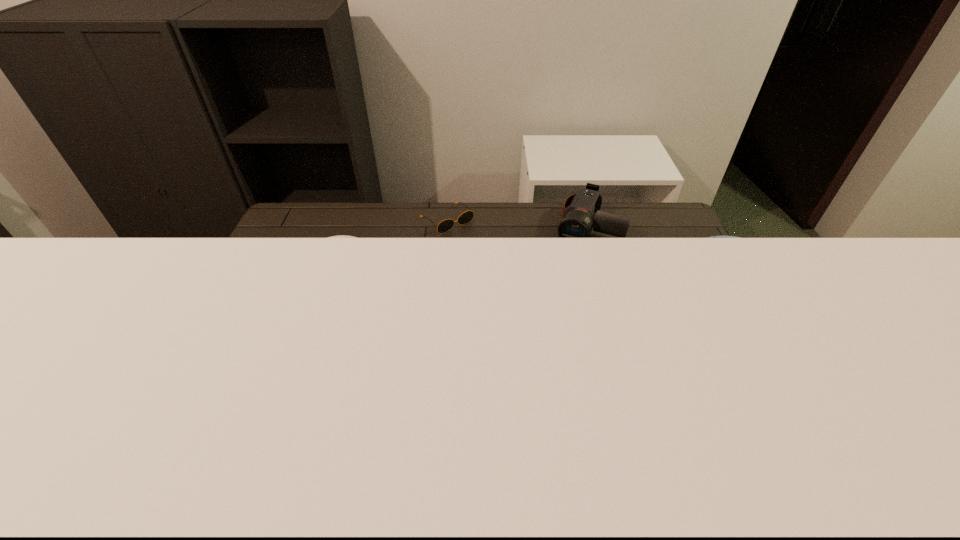
This screenshot has height=540, width=960. What are the coordinates of `free point located 0.290m on the front-facing side of the shortest object` in the screenshot? It's located at (511, 279).

This screenshot has width=960, height=540. Identify the location of vacant area located 0.330m on the front-facing side of the shortest object. (518, 286).

Identify the location of camcorder at the far edge. (578, 221).

In order to click on sunglasses that is at the far edge in this screenshot , I will do (x=445, y=225).

This screenshot has width=960, height=540. I want to click on object present at the right edge, so click(712, 236).

The image size is (960, 540). I want to click on vacant region at the far edge of the desktop, so point(520,212).

In the image, there is a desktop. At what (x,y) coordinates should I click in order to perform the action: click on vacant space at the left edge. Please return your answer as a coordinate pair (x, y). The height and width of the screenshot is (540, 960). Looking at the image, I should click on (210, 372).

Locate an element on the screen. blank space at the far left corner of the desktop is located at coordinates (304, 228).

Where is `vacant area at the far right corner`? The height and width of the screenshot is (540, 960). vacant area at the far right corner is located at coordinates (639, 204).

Identify the location of vacant area between the left soccer ball and the third tallest object. (469, 273).